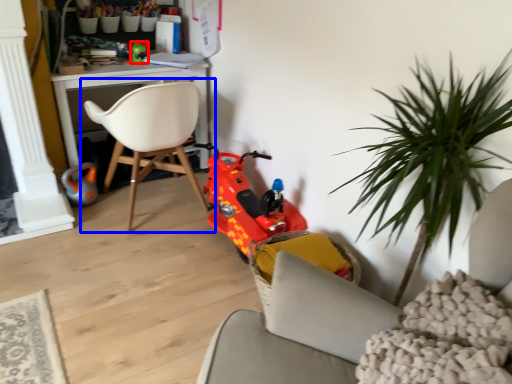
Question: Which of the following is the closest to the observer, toy (highlighted by a red box) or chair (highlighted by a blue box)?

Choices:
 (A) toy
 (B) chair

Answer: (B)